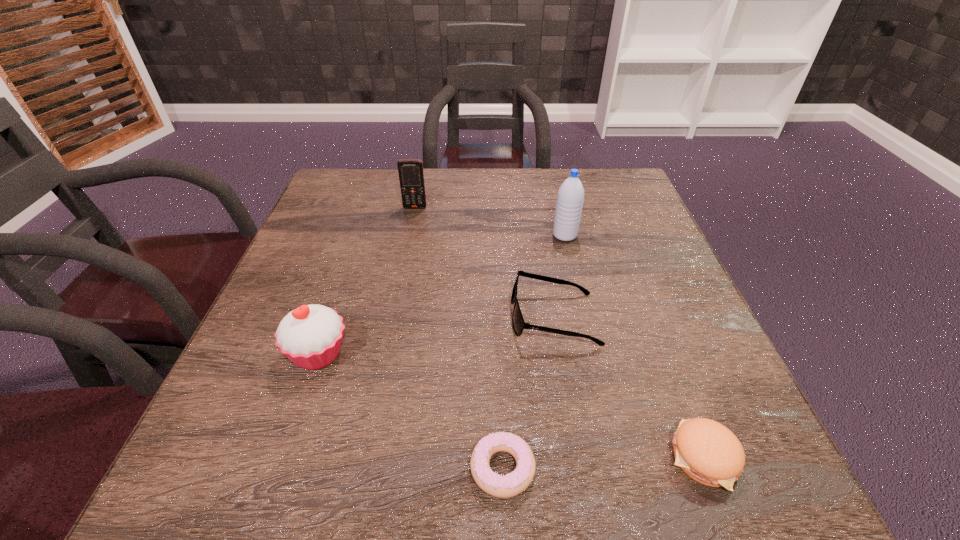
Identify the location of free point between the cellular telephone and the fifth nearest object. This screenshot has height=540, width=960. (490, 221).

Locate an element on the screen. The width and height of the screenshot is (960, 540). free area in between the water bottle and the fifth object from right to left is located at coordinates (490, 221).

I want to click on blank region between the tallest object and the fifth object from right to left, so click(x=490, y=221).

The width and height of the screenshot is (960, 540). I want to click on free spot between the sunglasses and the patty, so click(629, 388).

Locate an element on the screen. The width and height of the screenshot is (960, 540). vacant area between the tallest object and the farthest object is located at coordinates (490, 221).

You are a GUI agent. You are given a task and a screenshot of the screen. Output one action in this format:
    pyautogui.click(x=<x>, y=<y>)
    Task: Click on the vacant area between the shortest object and the rightmost object
    The width and height of the screenshot is (960, 540).
    Given the screenshot: What is the action you would take?
    pyautogui.click(x=603, y=463)

Locate an element on the screen. This screenshot has width=960, height=540. empty space between the doughnut and the fourth tallest object is located at coordinates pyautogui.click(x=528, y=393).

Find the location of a particular element. This screenshot has width=960, height=540. vacant space that's between the second farthest object and the third tallest object is located at coordinates (442, 294).

Identify the location of vacant space that is in between the water bottle and the cupcake. Image resolution: width=960 pixels, height=540 pixels. (442, 294).

I want to click on empty space that is in between the cupcake and the shortest object, so click(411, 411).